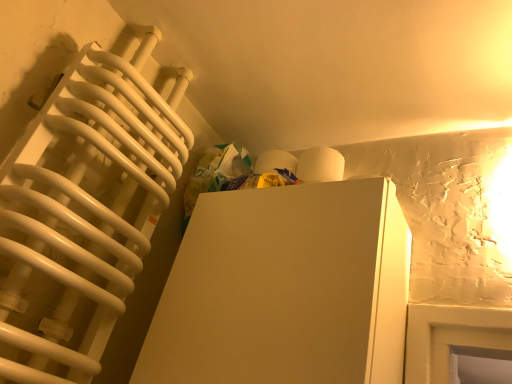
What do you see at coordinates (285, 289) in the screenshot? I see `matte white cabinet at center` at bounding box center [285, 289].

Where is `matte white cabinet at center`? The image size is (512, 384). matte white cabinet at center is located at coordinates (285, 289).

Identify the location of matte white cabinet at center. The height and width of the screenshot is (384, 512). (285, 289).